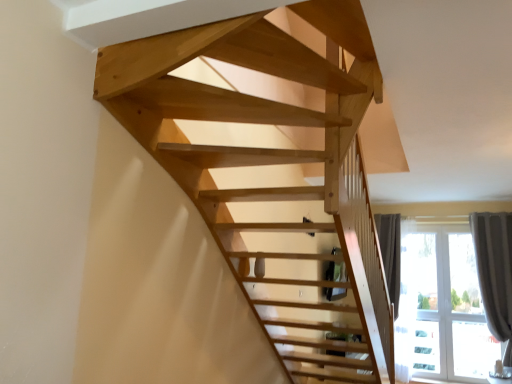
Locate an element on the screen. This screenshot has width=512, height=384. gray fabric curtain at right is located at coordinates (495, 272).

The width and height of the screenshot is (512, 384). Describe the element at coordinates (495, 272) in the screenshot. I see `gray fabric curtain at right` at that location.

At what (x,y) coordinates should I click in order to perform the action: click on gray fabric curtain at right. Please return your answer as a coordinate pair (x, y). The image size is (512, 384). Looking at the image, I should click on (495, 272).